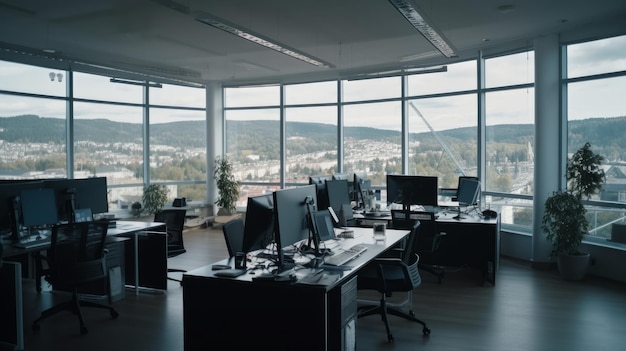
Locate an element on the screen. The width and height of the screenshot is (626, 351). white posts between large windows is located at coordinates (218, 93), (208, 135), (212, 191), (545, 118), (544, 72), (545, 191).